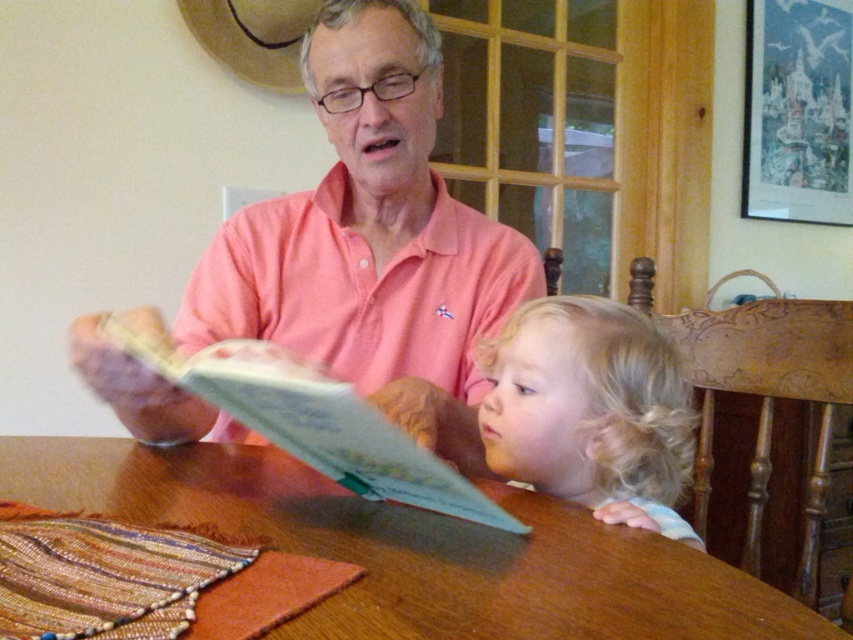
Question: Which of the following is the closest to the observer?

Choices:
 (A) (357, 54)
 (B) (524, 435)

Answer: (B)

Question: Can you confirm if wooden table at center is positioned below light blue paper book at center?

Choices:
 (A) yes
 (B) no

Answer: (A)

Question: Does wooden table at center appear under light blue paper book at center?

Choices:
 (A) yes
 (B) no

Answer: (A)

Question: Which object appears closest to the camera in this image?

Choices:
 (A) blonde hair at center
 (B) wooden table at center
 (C) pink cotton shirt at center
 (D) light blue paper book at center

Answer: (B)

Question: Which object is farther from the camera taking this photo?

Choices:
 (A) pink cotton shirt at center
 (B) light blue paper book at center
 (C) blonde hair at center
 (D) wooden table at center

Answer: (A)

Question: Does wooden table at center have a larger size compared to blonde hair at center?

Choices:
 (A) no
 (B) yes

Answer: (A)